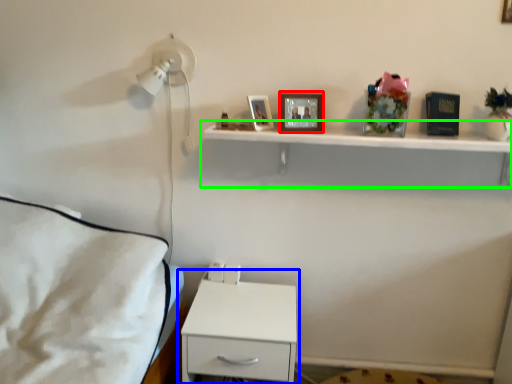
Question: Which object is positioned farthest from picture frame (highlighted by a red box)? Select from nightstand (highlighted by a blue box) and shelf (highlighted by a green box).

Choices:
 (A) nightstand
 (B) shelf

Answer: (A)